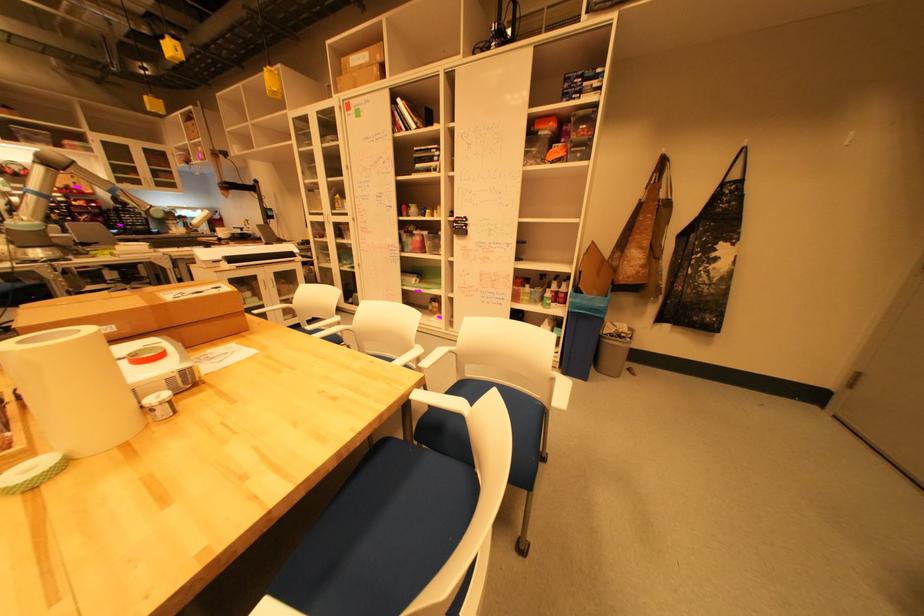
Find the location of a particular element. Image resolution: width=924 pixels, height=616 pixels. spray bottle is located at coordinates tap(564, 292).